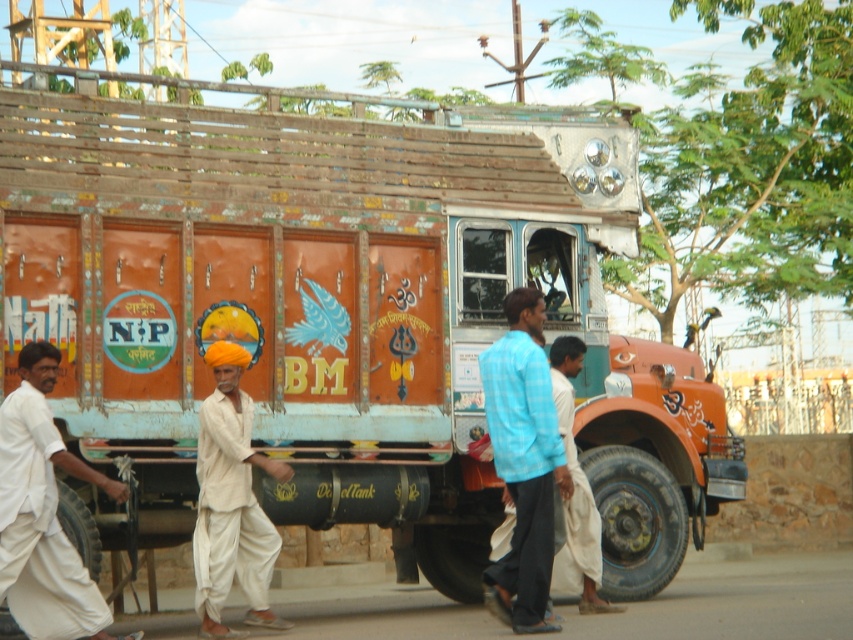
What is the color of the object located at the coordinates point (x=44, y=513)?

The object at point (x=44, y=513) is a white cotton turban at left.

You are standing in front of the truck and notice two points marked on its body. The first point is at coordinates point (x=44, y=634) and the second is at point (x=509, y=304). Which point is closer to you?

Point (x=44, y=634) is closer to the viewer than point (x=509, y=304).